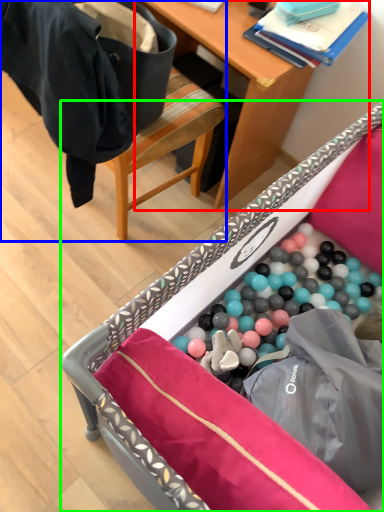
Question: Based on their relative distances, which object is farther from desk (highlighted by a red box)? Choose from chair (highlighted by a blue box) and furniture (highlighted by a green box).

Choices:
 (A) chair
 (B) furniture

Answer: (B)